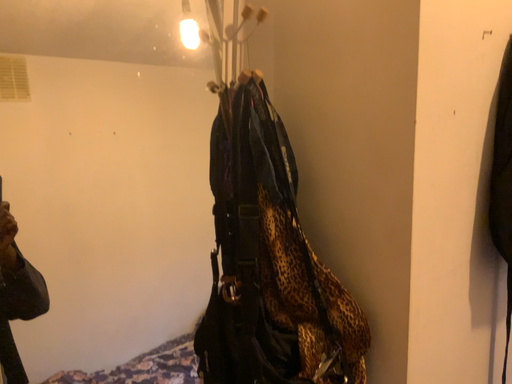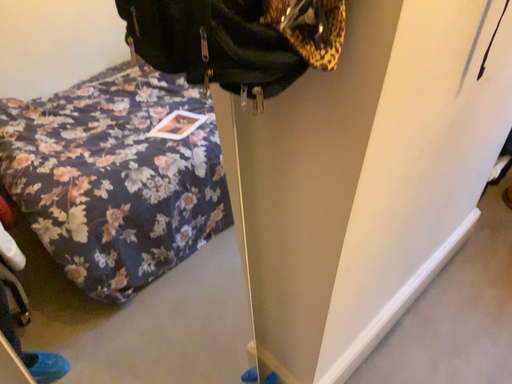
Question: Which way did the camera rotate in the video?

Choices:
 (A) rotated downward
 (B) rotated upward

Answer: (A)